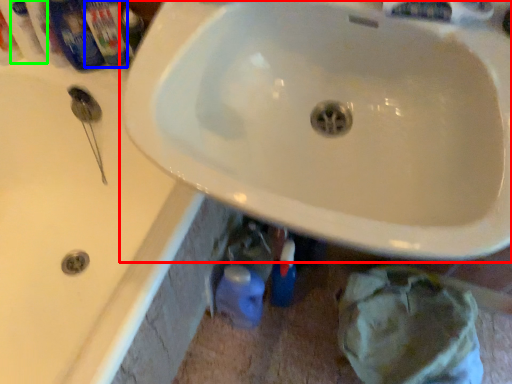
Question: Which object is positioned closest to sink (highlighted by a red box)? Select from toiletry (highlighted by a blue box) and mouthwash (highlighted by a green box).

Choices:
 (A) toiletry
 (B) mouthwash

Answer: (A)